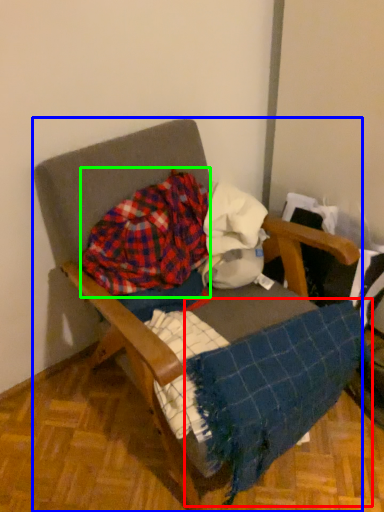
Question: Which object is positioned farthest from blanket (highlighted by a red box)? Select from furniture (highlighted by a blue box) and flannel (highlighted by a green box).

Choices:
 (A) furniture
 (B) flannel

Answer: (B)